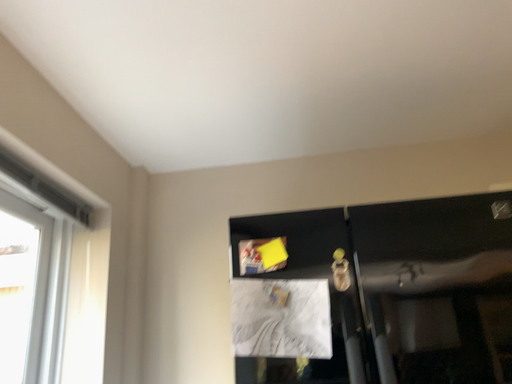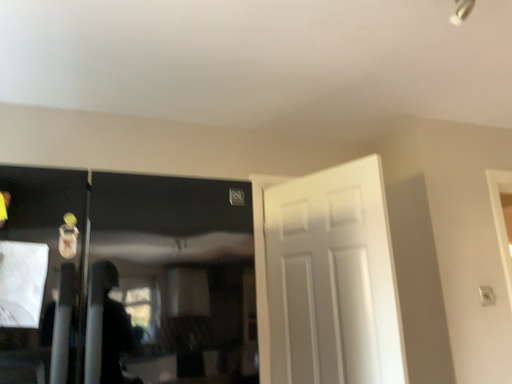
Question: How did the camera likely rotate when shooting the video?

Choices:
 (A) rotated downward
 (B) rotated upward

Answer: (A)